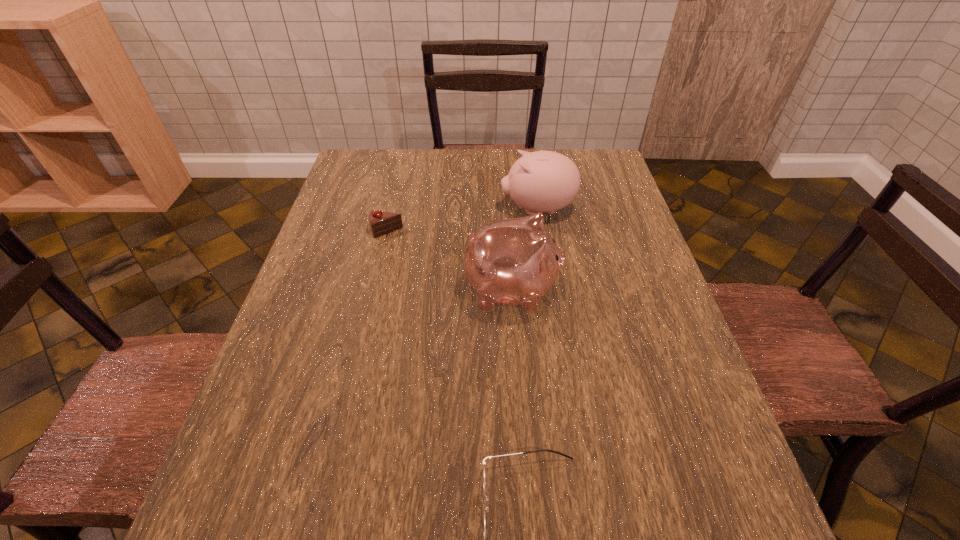
Where is `object that stands as the closest to the spectacles`? object that stands as the closest to the spectacles is located at coordinates (515, 261).

The image size is (960, 540). I want to click on the closest object to the shortest object, so (515, 261).

At what (x,y) coordinates should I click in order to perform the action: click on vacant space that satisfies the following two spatial constraints: 1. on the front facing side of the nearer piggy bank; 2. on the front side of the leftmost object. Please return your answer as a coordinate pair (x, y). The width and height of the screenshot is (960, 540). Looking at the image, I should click on (508, 231).